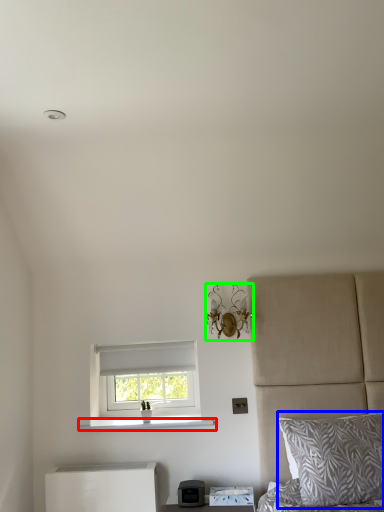
Question: Which object is the closest to the window sill (highlighted by a red box)? Choose among these: pillow (highlighted by a blue box) or light fixture (highlighted by a green box).

Choices:
 (A) pillow
 (B) light fixture

Answer: (B)